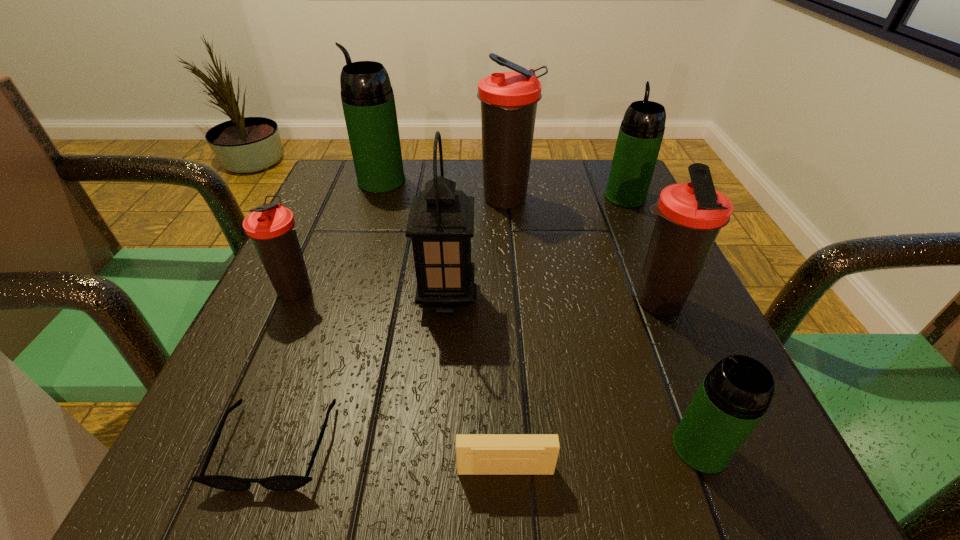
Locate an element on the screen. The height and width of the screenshot is (540, 960). the second shortest object is located at coordinates (476, 454).

At what (x,y) coordinates should I click in order to perform the action: click on sunglasses. Please return your answer as a coordinate pair (x, y). The width and height of the screenshot is (960, 540). Looking at the image, I should click on (280, 482).

The image size is (960, 540). Identify the location of the shortest object. (280, 482).

Find the location of a particular element. The width and height of the screenshot is (960, 540). vacant area situated 0.120m on the left of the biggest brown thermos bottle is located at coordinates (423, 200).

You are a GUI agent. You are given a task and a screenshot of the screen. Output one action in this format:
    pyautogui.click(x=<x>, y=<y>)
    Task: Click on the vacant area located 0.050m from the spout of the leftmost green thermos bottle
    
    Given the screenshot: What is the action you would take?
    pyautogui.click(x=336, y=181)

Where is `vacant space located from the spout of the leftmost green thermos bottle`? The image size is (960, 540). vacant space located from the spout of the leftmost green thermos bottle is located at coordinates (336, 181).

The image size is (960, 540). Identify the location of vacant point located on the back of the black lantern. (456, 190).

Locate an element on the screen. The height and width of the screenshot is (540, 960). blank space located from the spout of the second smallest green thermos bottle is located at coordinates (611, 164).

Identify the location of free space located from the spout of the second smallest green thermos bottle. (612, 170).

Identify the location of free region located 0.050m on the front of the second smallest brown thermos bottle. The width and height of the screenshot is (960, 540). (676, 350).